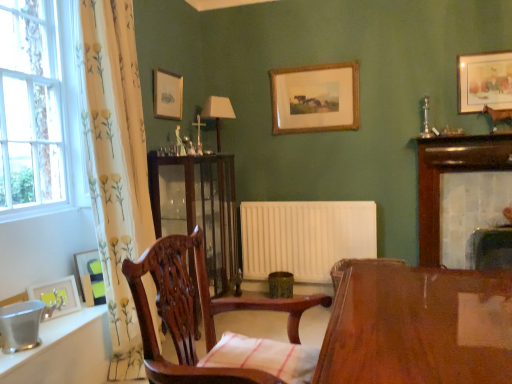
Describe the element at coordinates (115, 164) in the screenshot. I see `white floral curtain at left` at that location.

Image resolution: width=512 pixels, height=384 pixels. What do you see at coordinates (305, 237) in the screenshot? I see `white matte radiator at center` at bounding box center [305, 237].

Find the location of a particular element. This screenshot has height=384, width=512. white floral curtain at left is located at coordinates (115, 164).

Is point (140, 355) closer to viewer compared to point (160, 92)?

Yes, it is.

Does white floral curtain at left have a greater height compared to wooden picture frame at upper center, which ranks as the 3th picture frame in front-to-back order?

Yes, white floral curtain at left is taller than wooden picture frame at upper center, which ranks as the 3th picture frame in front-to-back order.

Is white floral curtain at left smaller than wooden picture frame at upper center, which is the 3th picture frame in left-to-right order?

No, white floral curtain at left is not smaller than wooden picture frame at upper center, which is the 3th picture frame in left-to-right order.

Which is correct: white matte radiator at center is inside brushed metal bucket at lower left, or outside of it?

white matte radiator at center lies outside brushed metal bucket at lower left.

How different are the orientations of white matte radiator at center and brushed metal bucket at lower left in degrees?

There is a 90.1-degree angle between the facing directions of white matte radiator at center and brushed metal bucket at lower left.

Find the location of a particular element. The height and width of the screenshot is (384, 512). radiator behind the brushed metal bucket at lower left is located at coordinates (305, 237).

Which of these two, white floral curtain at left or white matte radiator at center, stands taller?

Standing taller between the two is white floral curtain at left.

Is white matte radiator at center inside white floral curtain at left?

No.

Does white floral curtain at left have a greater width compared to white matte radiator at center?

Correct, the width of white floral curtain at left exceeds that of white matte radiator at center.

Considering the positions of objects matte green picture frame at lower left, positioned as the second picture frame in left-to-right order, and mahogany wooden chair at center in the image provided, who is more to the right, matte green picture frame at lower left, positioned as the second picture frame in left-to-right order, or mahogany wooden chair at center?

mahogany wooden chair at center is more to the right.

Considering the positions of points (94, 302) and (207, 337), is point (94, 302) closer to camera compared to point (207, 337)?

No, it is not.

Who is taller, matte green picture frame at lower left, positioned as the second picture frame in left-to-right order, or mahogany wooden chair at center?

Standing taller between the two is mahogany wooden chair at center.

Considering the sizes of objects matte green picture frame at lower left, placed as the fourth picture frame when sorted from back to front, and mahogany wooden chair at center in the image provided, who is wider, matte green picture frame at lower left, placed as the fourth picture frame when sorted from back to front, or mahogany wooden chair at center?

With larger width is mahogany wooden chair at center.

Can you tell me how much white tile fireplace at upper right and white glass window at left differ in facing direction?

There is a 89.7-degree angle between the facing directions of white tile fireplace at upper right and white glass window at left.

From the image's perspective, does white tile fireplace at upper right appear lower than white glass window at left?

Correct, white tile fireplace at upper right appears lower than white glass window at left in the image.

Is the depth of white tile fireplace at upper right less than that of white glass window at left?

That is False.

Between matte brown lamp at center and mahogany cabinet at center, which one is positioned in front?

mahogany cabinet at center is closer to the camera.

Which object is positioned more to the right, matte brown lamp at center or mahogany cabinet at center?

From the viewer's perspective, matte brown lamp at center appears more on the right side.

Identify the location of lamp that is on the right side of mahogany cabinet at center. The width and height of the screenshot is (512, 384). (217, 113).

Is matte brown lamp at center far from mahogany cabinet at center?

Actually, matte brown lamp at center and mahogany cabinet at center are a little close together.

Is white glass window at left to the right of wooden picture frame at upper right, which ranks as the 1th picture frame in top-to-bottom order, from the viewer's perspective?

In fact, white glass window at left is to the left of wooden picture frame at upper right, which ranks as the 1th picture frame in top-to-bottom order.

Looking at this image, is white glass window at left turned away from wooden picture frame at upper right, which ranks as the fifth picture frame in left-to-right order?

white glass window at left does not have its back to wooden picture frame at upper right, which ranks as the fifth picture frame in left-to-right order.

From the image's perspective, is white glass window at left above or below wooden picture frame at upper right, which ranks as the 1th picture frame in top-to-bottom order?

From the image's perspective, white glass window at left appears below wooden picture frame at upper right, which ranks as the 1th picture frame in top-to-bottom order.

From their relative heights in the image, would you say white glass window at left is taller or shorter than wooden picture frame at upper right, acting as the fifth picture frame starting from the bottom?

In the image, white glass window at left appears to be taller than wooden picture frame at upper right, acting as the fifth picture frame starting from the bottom.

From the image's perspective, which picture frame is the 1st one above the white floral curtain at left? Please provide its 2D coordinates.

[(167, 95)]

Where is `radiator behind the brushed metal bucket at lower left`? radiator behind the brushed metal bucket at lower left is located at coordinates (305, 237).

Looking at this image, based on their spatial positions, is mahogany cabinet at center or gold-framed picture at upper center, acting as the 4th picture frame starting from the left, closer to white floral curtain at left?

mahogany cabinet at center is positioned closer to the anchor white floral curtain at left.

Looking at the image, which one is located closer to gold-framed picture at upper center, which ranks as the 4th picture frame in bottom-to-top order, matte brown lamp at center or wooden picture frame at upper center, which ranks as the third picture frame in back-to-front order?

matte brown lamp at center is positioned closer to the anchor gold-framed picture at upper center, which ranks as the 4th picture frame in bottom-to-top order.

Which object lies further to the anchor point wooden picture frame at upper center, which ranks as the third picture frame in back-to-front order, matte green picture frame at lower left, arranged as the fourth picture frame when viewed from the top, or wooden picture frame at upper right, the 2th picture frame viewed from the back?

wooden picture frame at upper right, the 2th picture frame viewed from the back.

In the scene shown: From the image, which object appears to be nearer to white matte radiator at center, matte yellow picture frame at lower left, placed as the 1th picture frame when sorted from bottom to top, or matte brown lamp at center?

matte brown lamp at center is closer to white matte radiator at center.

From the picture: Based on their spatial positions, is mahogany wooden chair at center or white floral curtain at left further from white tile fireplace at upper right?

white floral curtain at left is further to white tile fireplace at upper right.

When comparing their distances from brushed metal bucket at lower left, does wooden picture frame at upper center, which is the 3th picture frame in left-to-right order, or white tile fireplace at upper right seem further?

white tile fireplace at upper right lies further to brushed metal bucket at lower left than the other object.

When comparing their distances from mahogany cabinet at center, does brushed metal bucket at lower left or white matte radiator at center seem further?

The object further to mahogany cabinet at center is brushed metal bucket at lower left.

Estimate the real-world distances between objects in this image. Which object is further from wooden picture frame at upper right, which ranks as the fifth picture frame in left-to-right order, white glass window at left or mahogany wooden chair at center?

The object further to wooden picture frame at upper right, which ranks as the fifth picture frame in left-to-right order, is white glass window at left.

Find the location of `radiator between matte yellow picture frame at lower left, the first picture frame from the front, and wooden picture frame at upper right, the 1th picture frame in the right-to-left sequence, in the horizontal direction`. radiator between matte yellow picture frame at lower left, the first picture frame from the front, and wooden picture frame at upper right, the 1th picture frame in the right-to-left sequence, in the horizontal direction is located at coordinates (305, 237).

Locate an element on the screen. This screenshot has width=512, height=384. window between mahogany wooden chair at center and gold-framed picture at upper center, the 5th picture frame when ordered from front to back, from front to back is located at coordinates (40, 115).

The image size is (512, 384). In order to click on window located between mahogany wooden chair at center and wooden picture frame at upper center, which is the 3th picture frame in left-to-right order, in the depth direction in this screenshot , I will do `click(40, 115)`.

I want to click on curtain located between mahogany wooden chair at center and matte green picture frame at lower left, placed as the 2th picture frame when sorted from front to back, in the depth direction, so click(x=115, y=164).